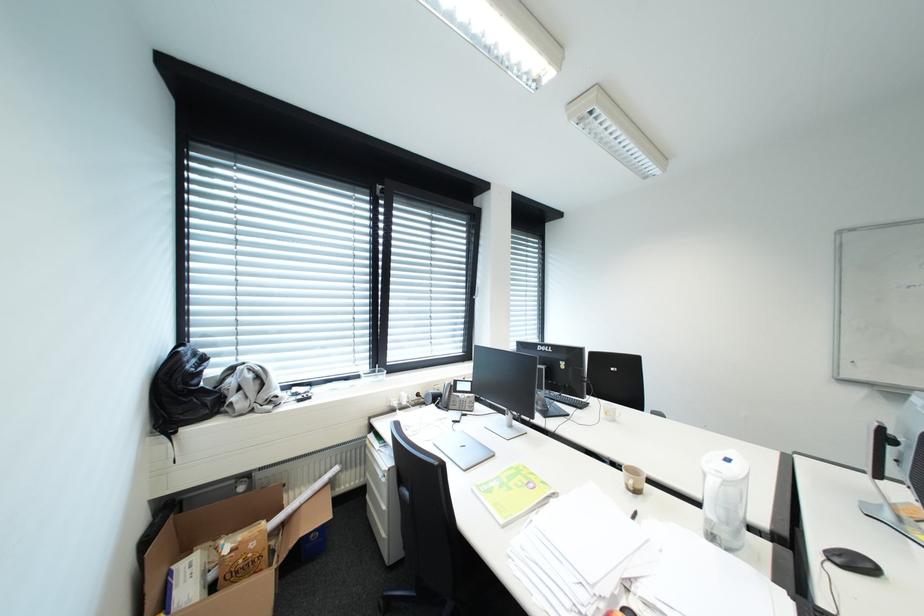
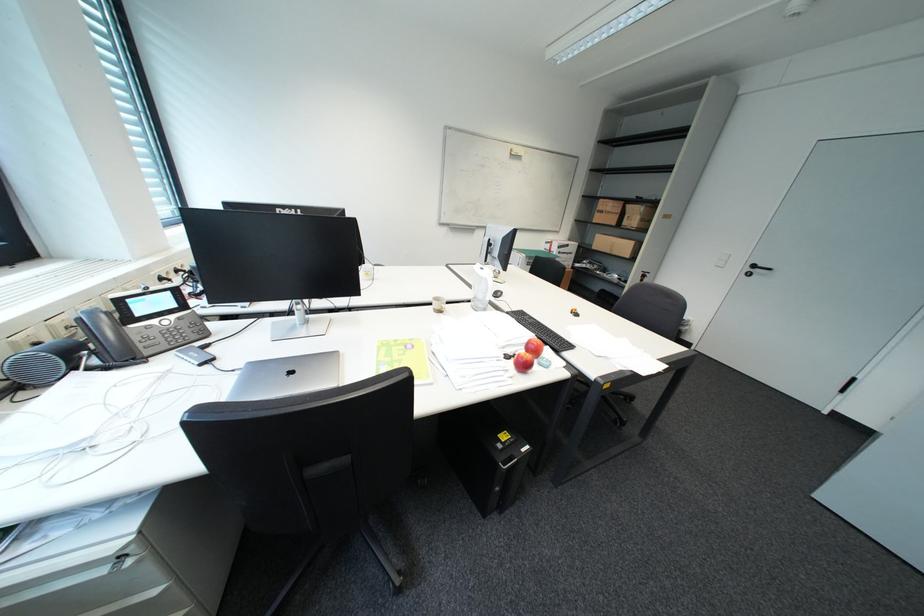
The images are taken continuously from a first-person perspective. In which direction is your viewpoint rotating?

The camera's rotation is toward right-down.